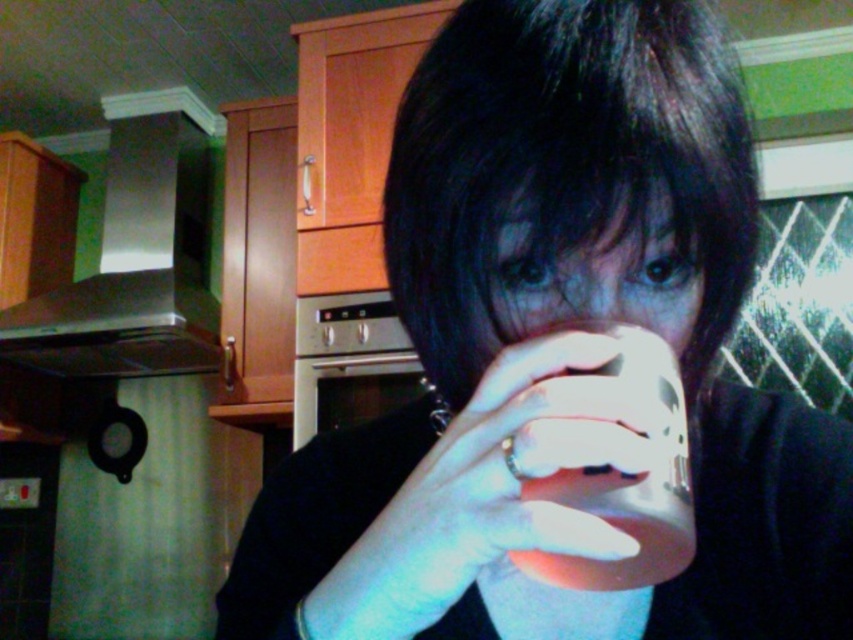
You are a photographer trying to capture the point at coordinate point (486, 492) in the image. Based on the scene description, where would you expect this point to be located?

The point at coordinate point (486, 492) is on white matte cup at center, so you should aim your camera at the center of the white matte cup to capture it.

You are a photographer adjusting the focus on your camera. You notice two points in the scene labeled as point (521, 243) and point (657, 442). Which point is closer to you, the photographer?

Point (521, 243) is further to the viewer than point (657, 442), so the closer point to you is point (657, 442).

You are a professional chef working in a kitchen with a satin silver exhaust hood at upper left. You need to hang a decorative hook exactly 10 cm below the exhaust hood. Where should you place the hook?

The hook should be placed 10 cm below the satin silver exhaust hood at upper left, which is located at point (136, 257). The coordinates for the hook placement would be approximately (222, 257).